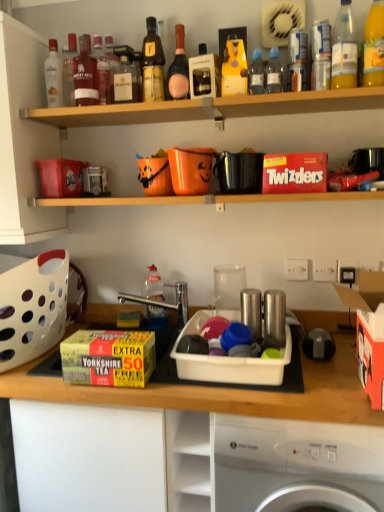
Identify the location of matte glass bottle at upper left, the first bottle when ordered from left to right. This screenshot has height=512, width=384. (53, 76).

The image size is (384, 512). Identify the location of matte plastic box at left, the first box viewed from the left. (61, 177).

At what (x,y) coordinates should I click in order to perform the action: click on pink glass bottle at upper center, arranged as the seventh bottle when viewed from the right. Please return your answer as a coordinate pair (x, y). The height and width of the screenshot is (512, 384). Looking at the image, I should click on (179, 68).

Measure the distance between pink glass bottle at upper center, arranged as the seventh bottle when viewed from the right, and camera.

→ A distance of 4.69 feet exists between pink glass bottle at upper center, arranged as the seventh bottle when viewed from the right, and camera.

This screenshot has width=384, height=512. In order to click on yellow plastic bottle at upper center, the sixth bottle positioned from the right in this screenshot , I will do `click(234, 68)`.

Are transparent plastic bottle at upper center, the 8th bottle from the left, and matte glass bottle at upper left, placed as the 12th bottle when sorted from right to left, located far from each other?

transparent plastic bottle at upper center, the 8th bottle from the left, is actually quite close to matte glass bottle at upper left, placed as the 12th bottle when sorted from right to left.

Can you confirm if transparent plastic bottle at upper center, the 8th bottle from the left, is positioned to the right of matte glass bottle at upper left, placed as the 12th bottle when sorted from right to left?

Indeed, transparent plastic bottle at upper center, the 8th bottle from the left, is positioned on the right side of matte glass bottle at upper left, placed as the 12th bottle when sorted from right to left.

Is transparent plastic bottle at upper center, the 8th bottle from the left, not inside matte glass bottle at upper left, the first bottle when ordered from left to right?

transparent plastic bottle at upper center, the 8th bottle from the left, lies outside matte glass bottle at upper left, the first bottle when ordered from left to right,'s area.

Could you measure the distance between transparent plastic bottle at upper center, acting as the 5th bottle starting from the right, and matte glass bottle at upper left, the first bottle when ordered from left to right?

They are 29.58 inches apart.

Is transparent plastic bottle at upper center, acting as the 5th bottle starting from the right, turned away from yellow cardboard box at center, which is the 3th box from top to bottom?

transparent plastic bottle at upper center, acting as the 5th bottle starting from the right, does not have its back to yellow cardboard box at center, which is the 3th box from top to bottom.

Which object is more forward, transparent plastic bottle at upper center, the 8th bottle from the left, or yellow cardboard box at center, which is the 3th box from top to bottom?

Positioned in front is yellow cardboard box at center, which is the 3th box from top to bottom.

Locate an element on the screen. This screenshot has width=384, height=512. bottle that is the 3rd one above the yellow cardboard box at center, which appears as the 3th box when viewed from the back (from a real-world perspective) is located at coordinates (256, 74).

Based on the photo, from a real-world perspective, is transparent plastic bottle at center, which is the fourth bottle in left-to-right order, below yellow cardboard box at center?

No, from a real-world perspective, transparent plastic bottle at center, which is the fourth bottle in left-to-right order, is not under yellow cardboard box at center.

Considering the relative sizes of transparent plastic bottle at center, which is the fourth bottle in left-to-right order, and yellow cardboard box at center in the image provided, is transparent plastic bottle at center, which is the fourth bottle in left-to-right order, smaller than yellow cardboard box at center?

Indeed, transparent plastic bottle at center, which is the fourth bottle in left-to-right order, has a smaller size compared to yellow cardboard box at center.

Is point (152, 293) behind point (12, 399)?

Yes.

Is transparent plastic bottle at center, the ninth bottle in the right-to-left sequence, taller than yellow cardboard box at center?

No, transparent plastic bottle at center, the ninth bottle in the right-to-left sequence, is not taller than yellow cardboard box at center.

Consider the image. How much distance is there between matte plastic box at left, which is the first box in back-to-front order, and pink glass bottle at upper center, which is the 6th bottle in left-to-right order?

21.10 inches.

Is point (56, 175) positioned before point (186, 60)?

No, (56, 175) is further to viewer.

Is matte plastic box at left, which appears as the third box when ordered from the bottom, directly adjacent to pink glass bottle at upper center, arranged as the seventh bottle when viewed from the right?

They are not placed beside each other.

From a real-world perspective, who is located higher, matte plastic box at left, the first box viewed from the left, or pink glass bottle at upper center, which is the 6th bottle in left-to-right order?

From a 3D spatial view, pink glass bottle at upper center, which is the 6th bottle in left-to-right order, is above.

How many degrees apart are the facing directions of pink glass bottle at upper center, which is the 6th bottle in left-to-right order, and matte glass bottles at upper center?

They differ by 0.922 degrees in their facing directions.

Considering the relative positions of pink glass bottle at upper center, which is the 6th bottle in left-to-right order, and matte glass bottles at upper center in the image provided, is pink glass bottle at upper center, which is the 6th bottle in left-to-right order, behind matte glass bottles at upper center?

Yes, it is.

Is pink glass bottle at upper center, arranged as the seventh bottle when viewed from the right, oriented towards matte glass bottles at upper center?

No, pink glass bottle at upper center, arranged as the seventh bottle when viewed from the right, does not turn towards matte glass bottles at upper center.

In terms of height, does pink glass bottle at upper center, arranged as the seventh bottle when viewed from the right, look taller or shorter compared to matte glass bottles at upper center?

pink glass bottle at upper center, arranged as the seventh bottle when viewed from the right, is taller than matte glass bottles at upper center.

Does point (45, 290) come behind point (310, 167)?

Yes, point (45, 290) is farther from viewer.

How much distance is there between white perforated basket at left and red cardboard twizzlers at upper center, the 1th box in the right-to-left sequence?

35.33 inches.

Is white perforated basket at left positioned with its back to red cardboard twizzlers at upper center, the 1th box in the right-to-left sequence?

white perforated basket at left does not have its back to red cardboard twizzlers at upper center, the 1th box in the right-to-left sequence.

From the image's perspective, relative to red cardboard twizzlers at upper center, which is the second box in top-to-bottom order, is white perforated basket at left above or below?

white perforated basket at left is below red cardboard twizzlers at upper center, which is the second box in top-to-bottom order.

Locate an element on the screen. the 1st box to the left when counting from the matte yellow glass bottle at upper center, acting as the 5th bottle starting from the left is located at coordinates (108, 358).

Which object is positioned more to the right, matte yellow glass bottle at upper center, acting as the 5th bottle starting from the left, or yellow cardboard box at center, which is the 1th box from bottom to top?

matte yellow glass bottle at upper center, acting as the 5th bottle starting from the left.

Is point (161, 45) positioned before point (148, 333)?

That is True.

Looking at this image, considering the relative positions of matte yellow glass bottle at upper center, acting as the 5th bottle starting from the left, and yellow cardboard box at center, which appears as the second box when viewed from the right, in the image provided, is matte yellow glass bottle at upper center, acting as the 5th bottle starting from the left, behind yellow cardboard box at center, which appears as the second box when viewed from the right,?

Yes, it is.

From a real-world perspective, count 3rd bottles upward from the transparent plastic bottle at upper center, the 8th bottle from the left, and point to it. Please provide its 2D coordinates.

[(53, 76)]

There is a transparent plastic bottle at upper center, the 8th bottle from the left. Identify the location of the 3rd box below it (from the image's perspective). The height and width of the screenshot is (512, 384). (108, 358).

Which object lies further to the anchor point clear plastic bottle at upper right, the second bottle in the right-to-left sequence, pink glass bottle at upper center, arranged as the seventh bottle when viewed from the right, or translucent plastic bottle at upper right, the 12th bottle when ordered from left to right?

Based on the image, pink glass bottle at upper center, arranged as the seventh bottle when viewed from the right, appears to be further to clear plastic bottle at upper right, the second bottle in the right-to-left sequence.

Which object lies nearer to the anchor point pink glass bottle at upper center, arranged as the seventh bottle when viewed from the right, transparent plastic bottle at center, the ninth bottle in the right-to-left sequence, or yellow cardboard box at center, arranged as the second box when viewed from the left?

transparent plastic bottle at center, the ninth bottle in the right-to-left sequence, lies closer to pink glass bottle at upper center, arranged as the seventh bottle when viewed from the right, than the other object.

Based on their spatial positions, is translucent plastic bottle at upper right, which is the first bottle in right-to-left order, or clear plastic bottle at upper right, which ranks as the third bottle in right-to-left order, closer to matte glass bottle at upper center, marked as the 10th bottle in a right-to-left arrangement?

clear plastic bottle at upper right, which ranks as the third bottle in right-to-left order, lies closer to matte glass bottle at upper center, marked as the 10th bottle in a right-to-left arrangement, than the other object.

Based on their spatial positions, is matte plastic box at left, acting as the third box starting from the front, or matte glass bottle at upper left, the first bottle when ordered from left to right, closer to pink glass bottle at upper center, arranged as the seventh bottle when viewed from the right?

Based on the image, matte glass bottle at upper left, the first bottle when ordered from left to right, appears to be nearer to pink glass bottle at upper center, arranged as the seventh bottle when viewed from the right.

Considering their positions, is orange cardboard box at right positioned closer to red cardboard twizzlers at upper center, the 1th box in the right-to-left sequence, than clear plastic bottle at upper right, which ranks as the third bottle in right-to-left order?

Based on the image, clear plastic bottle at upper right, which ranks as the third bottle in right-to-left order, appears to be nearer to red cardboard twizzlers at upper center, the 1th box in the right-to-left sequence.

From the image, which object appears to be nearer to yellow cardboard box at center, which is the 3th box from top to bottom, transparent plastic bottle at upper center, acting as the fourth bottle starting from the right, or matte yellow glass bottle at upper center, acting as the 5th bottle starting from the left?

Based on the image, matte yellow glass bottle at upper center, acting as the 5th bottle starting from the left, appears to be nearer to yellow cardboard box at center, which is the 3th box from top to bottom.

Based on their spatial positions, is shiny metallic canisters at center, the second appliance in the bottom-to-top sequence, or matte glass bottle at upper left, placed as the 12th bottle when sorted from right to left, further from matte glass whisky bottle at upper left, which is the eleventh bottle in right-to-left order?

Among the two, shiny metallic canisters at center, the second appliance in the bottom-to-top sequence, is located further to matte glass whisky bottle at upper left, which is the eleventh bottle in right-to-left order.

Considering their positions, is clear plastic bottle at upper right, which ranks as the third bottle in right-to-left order, positioned further to matte yellow glass bottle at upper center, acting as the 5th bottle starting from the left, than matte glass whisky bottle at upper left, which is the eleventh bottle in right-to-left order?

Based on the image, clear plastic bottle at upper right, which ranks as the third bottle in right-to-left order, appears to be further to matte yellow glass bottle at upper center, acting as the 5th bottle starting from the left.

You are a GUI agent. You are given a task and a screenshot of the screen. Output one action in this format:
    pyautogui.click(x=<x>, y=<y>)
    Task: Click on the cardboard box between clear plastic bottle at upper right, the eleventh bottle viewed from the left, and yellow cardboard box at center, in the vertical direction
    The height and width of the screenshot is (512, 384).
    Given the screenshot: What is the action you would take?
    pyautogui.click(x=368, y=331)

You are a GUI agent. You are given a task and a screenshot of the screen. Output one action in this format:
    pyautogui.click(x=<x>, y=<y>)
    Task: Click on the box between matte yellow glass bottle at upper center, which appears as the 8th bottle when viewed from the right, and clear plastic bottle at upper right, the second bottle in the right-to-left sequence, from left to right
    The height and width of the screenshot is (512, 384).
    Given the screenshot: What is the action you would take?
    pyautogui.click(x=295, y=173)

This screenshot has width=384, height=512. Identify the location of cabinetry between white perforated basket at left and shiny metallic canisters at center, the second appliance when ordered from top to bottom. (192, 441).

Locate an element on the screen. The height and width of the screenshot is (512, 384). cardboard box between transparent plastic bottle at upper center, the 8th bottle from the left, and yellow cardboard box at center, arranged as the second box when viewed from the left, vertically is located at coordinates (368, 331).